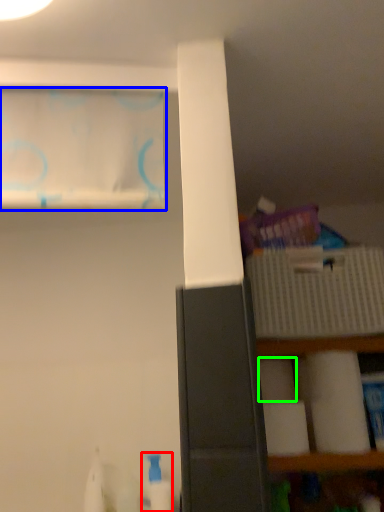
Question: Considering the real-world distances, which object is farthest from cleaning product (highlighted by a red box)? curtain (highlighted by a blue box) or toilet paper (highlighted by a green box)?

Choices:
 (A) curtain
 (B) toilet paper

Answer: (A)